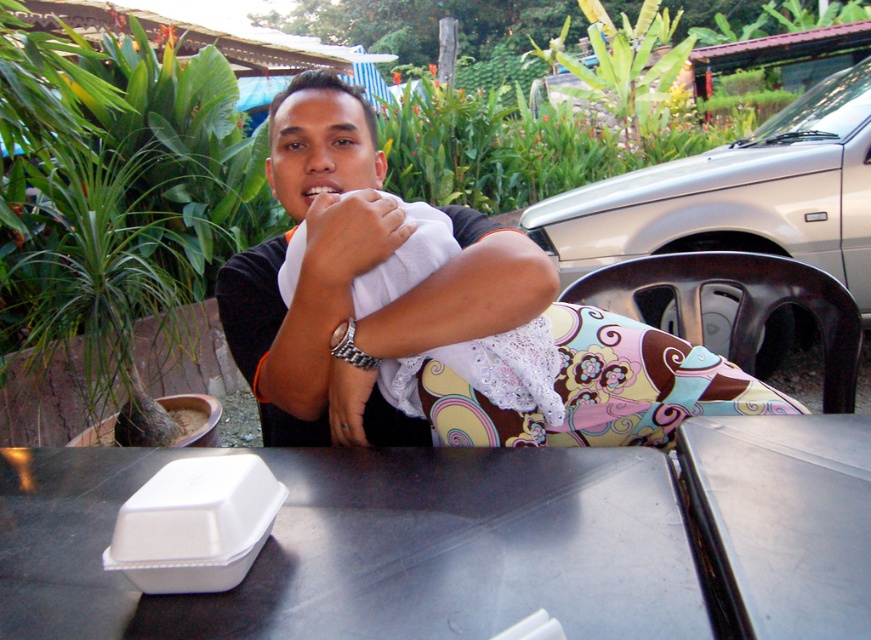
Question: Which of these objects is positioned farthest from the metallic silver table at center?

Choices:
 (A) white plastic table at center
 (B) white fabric at center
 (C) black fabric shirt at center

Answer: (B)

Question: Which object is positioned farthest from the white fabric at center?

Choices:
 (A) black fabric shirt at center
 (B) metallic silver table at center
 (C) white plastic table at center

Answer: (B)

Question: Is metallic silver table at center bigger than white fabric at center?

Choices:
 (A) yes
 (B) no

Answer: (A)

Question: Is white plastic table at center to the left of white fabric at center from the viewer's perspective?

Choices:
 (A) yes
 (B) no

Answer: (A)

Question: Which of the following is the closest to the observer?

Choices:
 (A) (832, 536)
 (B) (402, 237)
 (C) (575, 516)

Answer: (A)

Question: Is metallic silver table at center thinner than white fabric at center?

Choices:
 (A) yes
 (B) no

Answer: (B)